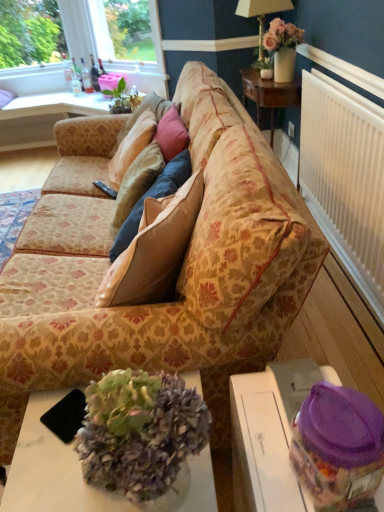
Question: Is pink matte vase at upper right completely or partially outside of floral-patterned fabric couch at center?

Choices:
 (A) no
 (B) yes

Answer: (B)

Question: Is the position of pink matte vase at upper right more distant than that of floral-patterned fabric couch at center?

Choices:
 (A) no
 (B) yes

Answer: (B)

Question: Is pink matte vase at upper right shorter than floral-patterned fabric couch at center?

Choices:
 (A) yes
 (B) no

Answer: (A)

Question: Is pink matte vase at upper right smaller than floral-patterned fabric couch at center?

Choices:
 (A) yes
 (B) no

Answer: (A)

Question: Considering the relative sizes of pink matte vase at upper right and floral-patterned fabric couch at center in the image provided, is pink matte vase at upper right taller than floral-patterned fabric couch at center?

Choices:
 (A) yes
 (B) no

Answer: (B)

Question: From the image's perspective, is floral-patterned fabric couch at center above or below white plastic radiator at right?

Choices:
 (A) above
 (B) below

Answer: (B)

Question: Is point (289, 240) closer or farther from the camera than point (324, 218)?

Choices:
 (A) farther
 (B) closer

Answer: (B)

Question: Is floral-patterned fabric couch at center taller or shorter than white plastic radiator at right?

Choices:
 (A) tall
 (B) short

Answer: (A)

Question: From a real-world perspective, is floral-patterned fabric couch at center above or below white plastic radiator at right?

Choices:
 (A) above
 (B) below

Answer: (A)

Question: From their relative heights in the image, would you say white marble desk at center is taller or shorter than translucent plastic container at lower right, the second table viewed from the left?

Choices:
 (A) tall
 (B) short

Answer: (B)

Question: Is white marble desk at center wider or thinner than translucent plastic container at lower right, placed as the 2th table when sorted from back to front?

Choices:
 (A) wide
 (B) thin

Answer: (A)

Question: Would you say white marble desk at center is inside or outside translucent plastic container at lower right, the second table viewed from the left?

Choices:
 (A) inside
 (B) outside

Answer: (B)

Question: From a real-world perspective, is white marble desk at center above or below translucent plastic container at lower right, the 1th table positioned from the bottom?

Choices:
 (A) below
 (B) above

Answer: (A)

Question: From a real-world perspective, is floral-patterned fabric couch at center positioned above or below matte gold lamp at upper center?

Choices:
 (A) below
 (B) above

Answer: (A)

Question: In terms of size, does floral-patterned fabric couch at center appear bigger or smaller than matte gold lamp at upper center?

Choices:
 (A) big
 (B) small

Answer: (A)